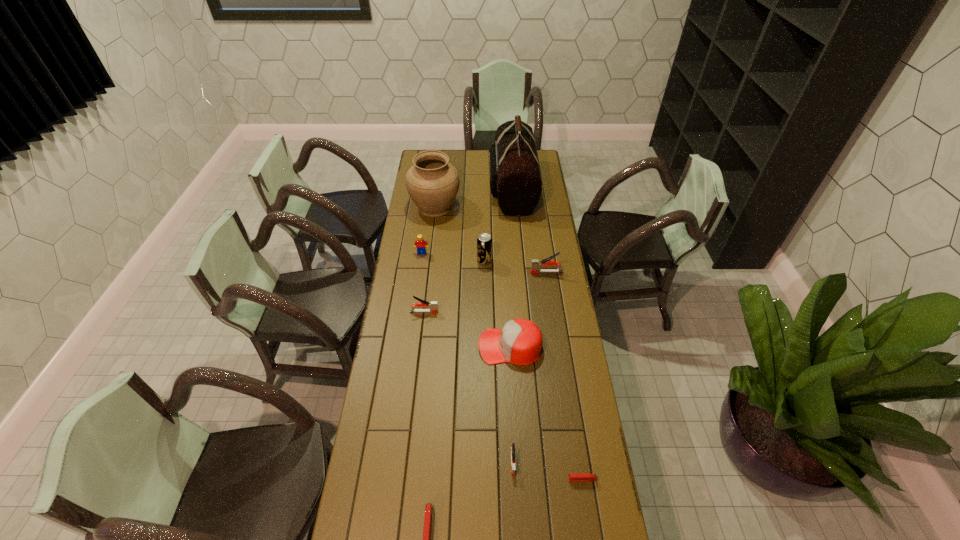
The width and height of the screenshot is (960, 540). What are the coordinates of `object that is positioned at the far right corner` in the screenshot? It's located at (515, 180).

You are a GUI agent. You are given a task and a screenshot of the screen. Output one action in this format:
    pyautogui.click(x=<x>, y=<y>)
    Task: Click on the vacant area at the far edge of the desktop
    
    Given the screenshot: What is the action you would take?
    pyautogui.click(x=468, y=165)

In the image, there is a desktop. At what (x,y) coordinates should I click in order to perform the action: click on vacant space at the left edge. Please return your answer as a coordinate pair (x, y). This screenshot has width=960, height=540. Looking at the image, I should click on (401, 467).

In the image, there is a desktop. Where is `vacant space at the right edge`? The image size is (960, 540). vacant space at the right edge is located at coordinates (544, 388).

Image resolution: width=960 pixels, height=540 pixels. Find the location of `vacant space at the far right corner of the desktop`. vacant space at the far right corner of the desktop is located at coordinates (542, 151).

In order to click on free point between the farthest gray stapler and the baseball cap in this screenshot , I will do `click(528, 309)`.

This screenshot has height=540, width=960. I want to click on free area in between the second gray stapler from left to right and the ninth farthest object, so click(547, 470).

This screenshot has width=960, height=540. Find the location of `vacant area that lies between the fourth farthest object and the second tallest object`. vacant area that lies between the fourth farthest object and the second tallest object is located at coordinates (460, 234).

The image size is (960, 540). Identify the location of vacant point located between the eighth shortest object and the seventh farthest object. (497, 303).

At what (x,y) coordinates should I click in order to perform the action: click on empty space between the duffel bag and the third tallest object. Please return your answer as a coordinate pair (x, y). The height and width of the screenshot is (540, 960). Looking at the image, I should click on (498, 224).